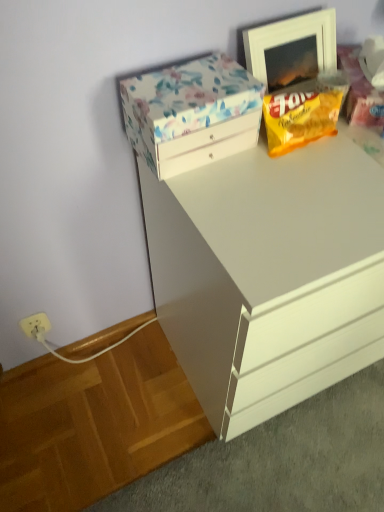
Question: Is floral-patterned cardboard box at upper left positioned with its back to yellow matte snack packet at upper right?

Choices:
 (A) no
 (B) yes

Answer: (A)

Question: Considering the relative positions of floral-patterned cardboard box at upper left and yellow matte snack packet at upper right in the image provided, is floral-patterned cardboard box at upper left to the right of yellow matte snack packet at upper right from the viewer's perspective?

Choices:
 (A) yes
 (B) no

Answer: (B)

Question: Is floral-patterned cardboard box at upper left located outside yellow matte snack packet at upper right?

Choices:
 (A) yes
 (B) no

Answer: (A)

Question: From a real-world perspective, is floral-patterned cardboard box at upper left over yellow matte snack packet at upper right?

Choices:
 (A) no
 (B) yes

Answer: (B)

Question: Can you confirm if floral-patterned cardboard box at upper left is positioned to the left of yellow matte snack packet at upper right?

Choices:
 (A) yes
 (B) no

Answer: (A)

Question: From a real-world perspective, relative to yellow matte snack packet at upper right, is white glossy chest of drawers at upper center vertically above or below?

Choices:
 (A) above
 (B) below

Answer: (B)

Question: From the image's perspective, is white glossy chest of drawers at upper center above or below yellow matte snack packet at upper right?

Choices:
 (A) above
 (B) below

Answer: (B)

Question: Would you say white glossy chest of drawers at upper center is to the left or to the right of yellow matte snack packet at upper right in the picture?

Choices:
 (A) left
 (B) right

Answer: (B)

Question: In terms of height, does white glossy chest of drawers at upper center look taller or shorter compared to yellow matte snack packet at upper right?

Choices:
 (A) short
 (B) tall

Answer: (B)

Question: From a real-world perspective, relative to white wooden picture frame at upper right, is floral-patterned cardboard box at upper left vertically above or below?

Choices:
 (A) above
 (B) below

Answer: (B)

Question: From the image's perspective, is floral-patterned cardboard box at upper left located above or below white wooden picture frame at upper right?

Choices:
 (A) above
 (B) below

Answer: (B)

Question: Based on their positions, is floral-patterned cardboard box at upper left located to the left or right of white wooden picture frame at upper right?

Choices:
 (A) right
 (B) left

Answer: (B)

Question: Is floral-patterned cardboard box at upper left taller or shorter than white wooden picture frame at upper right?

Choices:
 (A) tall
 (B) short

Answer: (B)

Question: Is white glossy chest of drawers at upper center inside or outside of floral-patterned cardboard box at upper left?

Choices:
 (A) outside
 (B) inside

Answer: (A)

Question: From a real-world perspective, is white glossy chest of drawers at upper center positioned above or below floral-patterned cardboard box at upper left?

Choices:
 (A) above
 (B) below

Answer: (B)